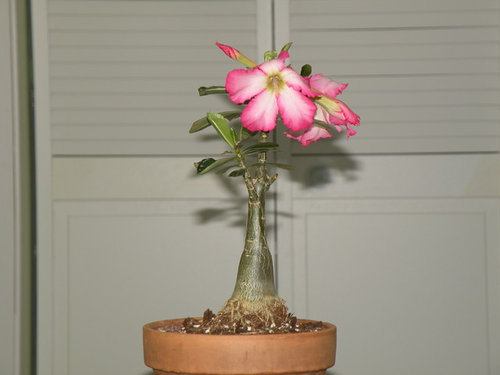
At what (x,y) coordinates should I click in order to perform the action: click on closet door. Please return your answer as a coordinate pair (x, y). The height and width of the screenshot is (375, 500). Looking at the image, I should click on (198, 255).